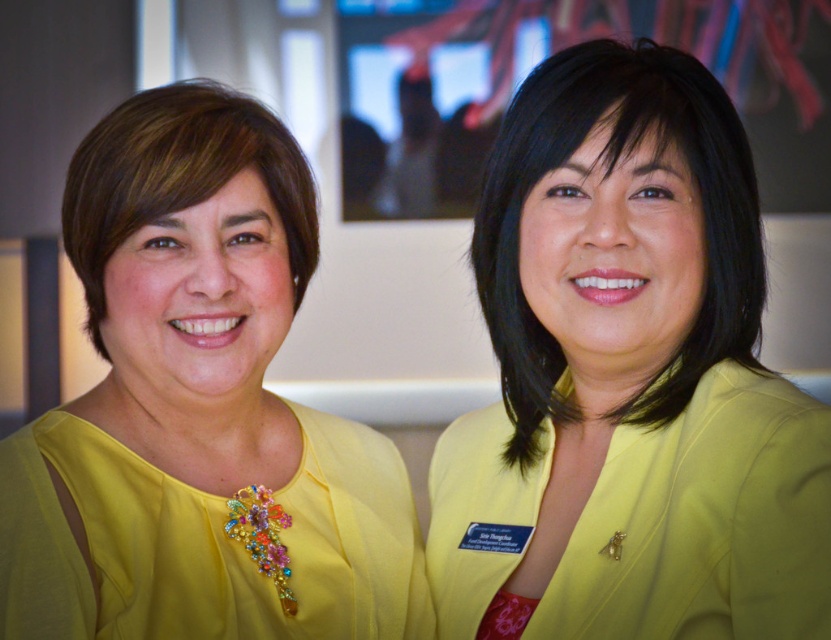
You are a photographer adjusting the focus on a camera. You notice two points in the image at coordinates point (610, 611) and point (175, 632). Which point is closer to the camera?

Point (610, 611) is closer to the camera than point (175, 632).

You are a photographer who wants to ensure that both the matte yellow blazer at center and the yellow satin blouse at left are clearly visible in the photo. Since the background is blurred, which clothing item should you focus on to ensure it remains sharp and in focus?

The matte yellow blazer at center is bigger than the yellow satin blouse at left, so focusing on the matte yellow blazer at center will ensure it remains sharp and in focus while the smaller blouse may also stay in focus depending on the depth of field.